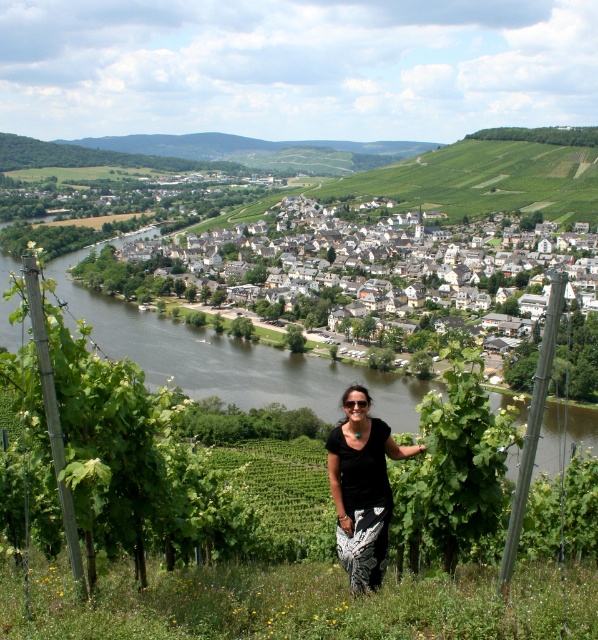
Question: Which of these objects is positioned closest to the dark brown water at center?

Choices:
 (A) black cotton top at center
 (B) white stone houses at center

Answer: (B)

Question: Where is dark brown water at center located in relation to black cotton top at center in the image?

Choices:
 (A) below
 (B) above

Answer: (B)

Question: Which object appears closest to the camera in this image?

Choices:
 (A) dark brown water at center
 (B) black cotton top at center
 (C) white stone houses at center

Answer: (A)

Question: Does white stone houses at center appear under black cotton top at center?

Choices:
 (A) yes
 (B) no

Answer: (B)

Question: Which point is farther from the camera taking this photo?

Choices:
 (A) (359, 531)
 (B) (575, 198)
 (C) (63, 298)

Answer: (B)

Question: Is white stone houses at center above black cotton top at center?

Choices:
 (A) yes
 (B) no

Answer: (A)